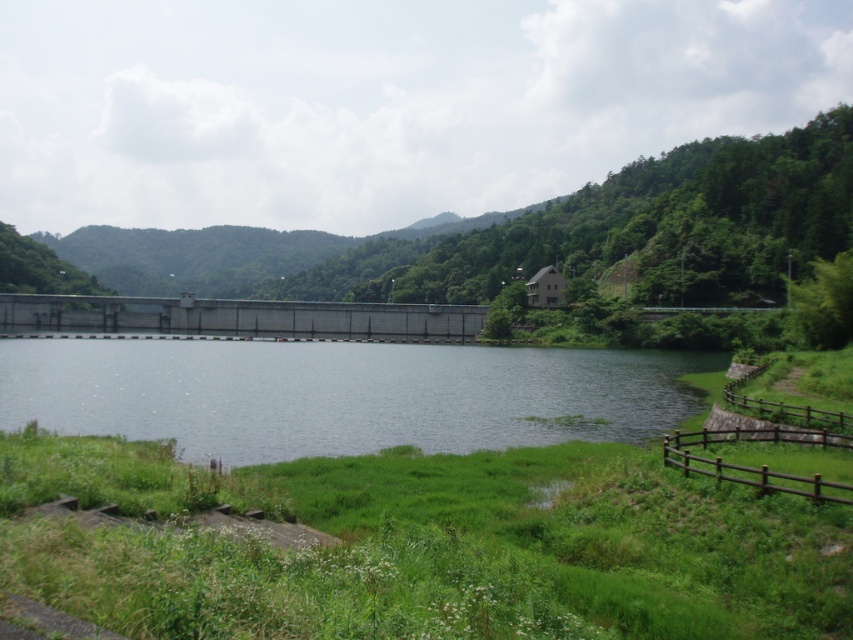
Can you confirm if clear water at center is positioned below concrete dam at center?

Yes.

Can you confirm if clear water at center is wider than concrete dam at center?

Incorrect, clear water at center's width does not surpass concrete dam at center's.

You are a GUI agent. You are given a task and a screenshot of the screen. Output one action in this format:
    pyautogui.click(x=<x>, y=<y>)
    Task: Click on the clear water at center
    This screenshot has height=640, width=853.
    Given the screenshot: What is the action you would take?
    pyautogui.click(x=341, y=394)

Image resolution: width=853 pixels, height=640 pixels. Identify the location of clear water at center. pyautogui.click(x=341, y=394).